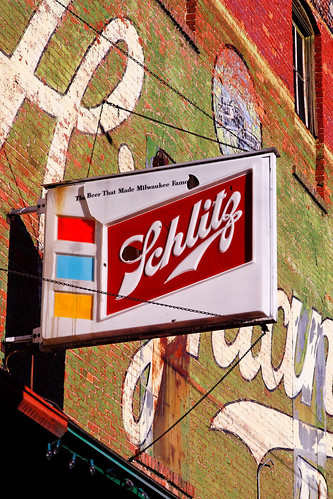
Image resolution: width=333 pixels, height=499 pixels. I want to click on vintage sign, so click(x=69, y=206).